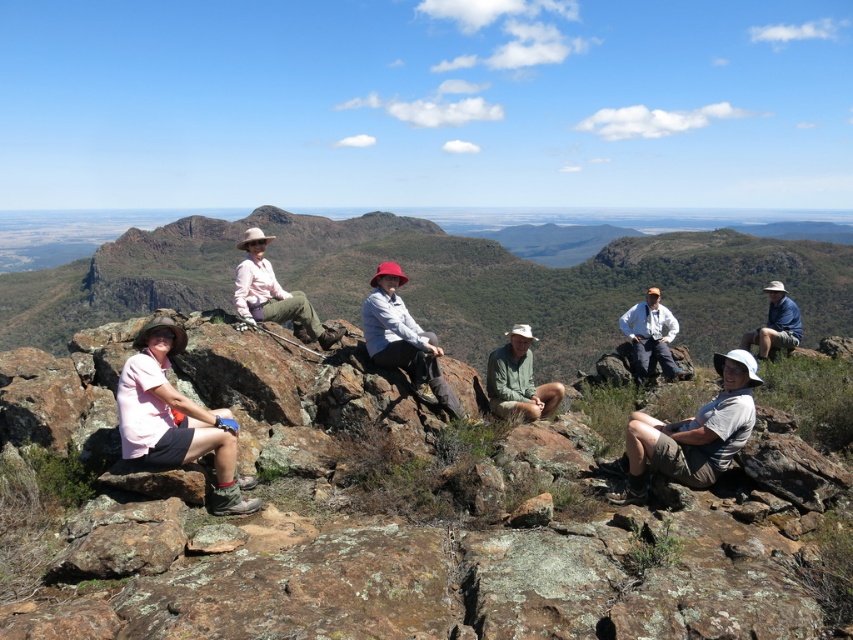
You are a photographer trying to capture a group photo of the seven people on the rocky outcrop. You notice two people wearing shirts labeled as green matte shirt at center and white cotton shirt at center. Which of these two shirts should you focus on if you want to ensure the subject appears larger in your photo?

The white cotton shirt at center is larger than the green matte shirt at center, so focusing on the white cotton shirt at center will make the subject appear larger in the photo.

You are a photographer trying to capture a group photo of the seven people on the rocky outcrop. You notice two hats in the scene, the gray fabric hat at lower right and the matte gray hat at center. To ensure both hats are visible in the frame, which hat should you position closer to the edge of the photo to avoid overcrowding the center?

The gray fabric hat at lower right might be wider than matte gray hat at center, so positioning the wider gray fabric hat at lower right closer to the edge would help prevent overcrowding the center of the photo.

You are standing at the point labeled as point (692, 433) in the image. Looking around, you see a gray fabric hat at lower right. Which direction should you face to see the gray fabric hat at lower right?

You should face toward the lower right direction to see the gray fabric hat at lower right, as the point (692, 433) corresponds to that location.